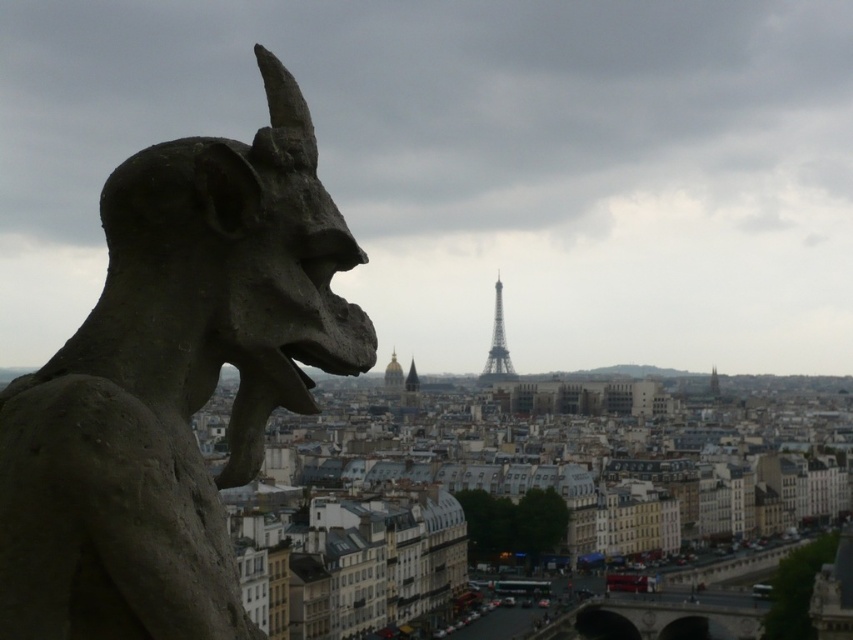
You are a photographer standing at the base of the Eiffel Tower and want to take a photo of the dark gray stone gargoyle at left. If your camera has a maximum zoom range of 100 feet, can you capture the gargoyle in your shot without moving closer?

The dark gray stone gargoyle at left and camera are 47.07 feet apart from each other. Since the camera can zoom up to 100 feet, which is greater than the distance between them, you can capture the gargoyle in your shot without moving closer.

You are an architect designing a new building in Paris. You want to place a new statue exactly where the dark gray stone gargoyle at left is currently located. What are the coordinates for placing the statue?

The coordinates for placing the statue should be at point (173, 384), as that is where the dark gray stone gargoyle at left is positioned.